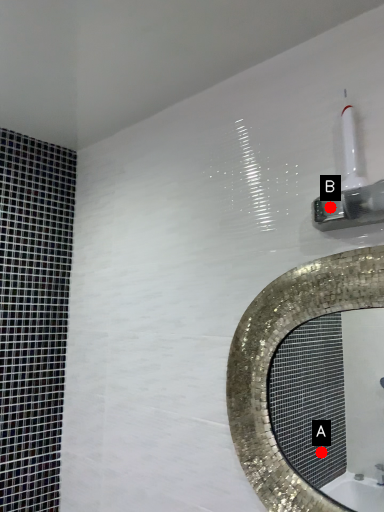
Question: Two points are circled on the image, labeled by A and B beside each circle. Which point is closer to the camera?

Choices:
 (A) A is closer
 (B) B is closer

Answer: (B)